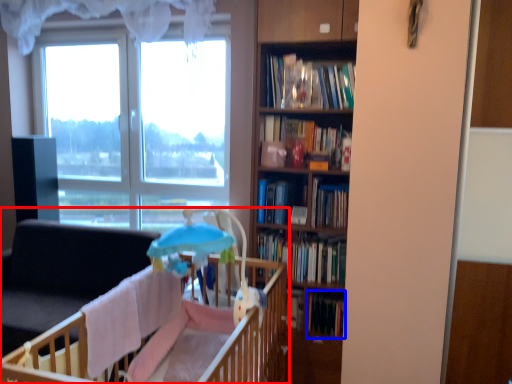
Question: Which object appears farthest to the camera in this image, infant bed (highlighted by a red box) or book (highlighted by a blue box)?

Choices:
 (A) infant bed
 (B) book

Answer: (B)